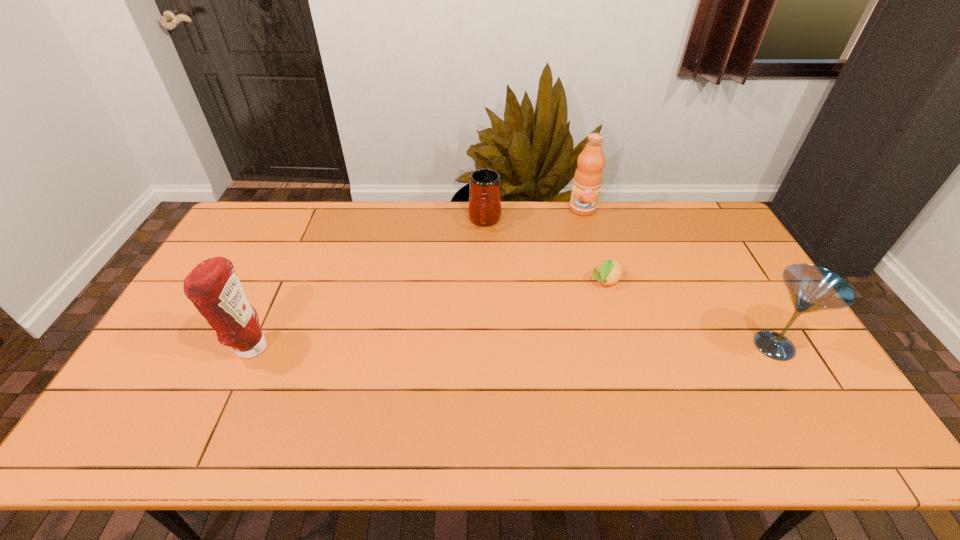
Where is `mug present at the far edge`? The image size is (960, 540). mug present at the far edge is located at coordinates (484, 209).

Where is `object located in the right edge section of the desktop`? This screenshot has width=960, height=540. object located in the right edge section of the desktop is located at coordinates (811, 288).

This screenshot has width=960, height=540. Identify the location of vacant space at the far edge of the desktop. [411, 228].

What are the coordinates of `free location at the near edge of the desktop` in the screenshot? It's located at (686, 380).

In the image, there is a desktop. Identify the location of free region at the left edge. (x=259, y=264).

Locate an element on the screen. free space at the right edge of the desktop is located at coordinates (751, 292).

Where is `free space at the near left corner`? free space at the near left corner is located at coordinates (126, 401).

Where is `free spot between the leftmost object and the shortest object`? The image size is (960, 540). free spot between the leftmost object and the shortest object is located at coordinates (428, 315).

Identify the location of vacant space that's between the third farthest object and the rightmost object. The height and width of the screenshot is (540, 960). (690, 314).

I want to click on unoccupied area between the shortest object and the leftmost object, so coord(428,315).